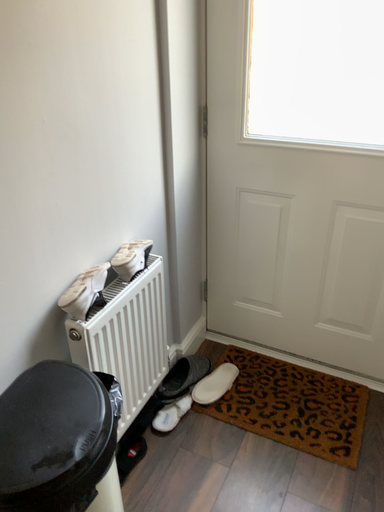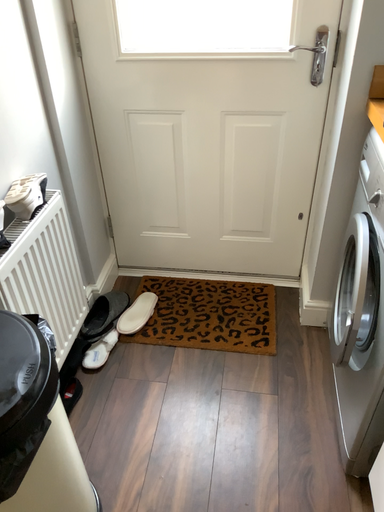
Question: Which way did the camera rotate in the video?

Choices:
 (A) rotated right
 (B) rotated left

Answer: (A)